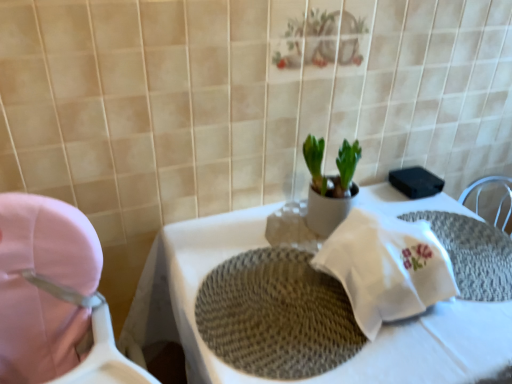
Question: In terms of height, does woven beige placemat at center look taller or shorter compared to white woven placemat at center?

Choices:
 (A) short
 (B) tall

Answer: (A)

Question: Choose the correct answer: Is woven beige placemat at center inside white woven placemat at center or outside it?

Choices:
 (A) inside
 (B) outside

Answer: (A)

Question: Which is farther from the white woven placemat at center?

Choices:
 (A) woven beige placemat at center
 (B) white woven placemat at center
 (C) pink fabric baby carriage at left

Answer: (C)

Question: Which is farther from the white woven placemat at center?

Choices:
 (A) woven beige placemat at center
 (B) white woven placemat at center
 (C) pink fabric baby carriage at left

Answer: (C)